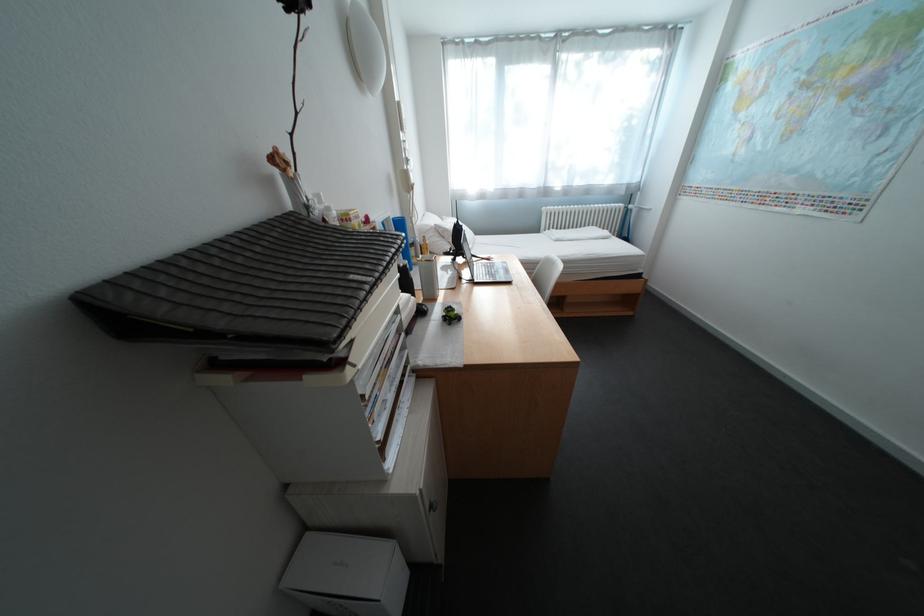
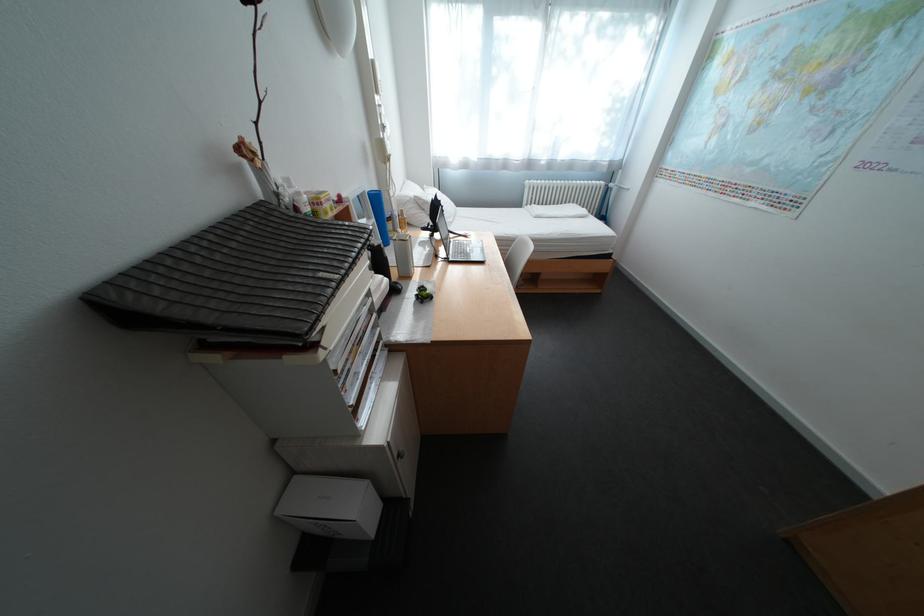
The point at [320,208] is marked in the first image. Where is the corresponding point in the second image?

(290, 196)